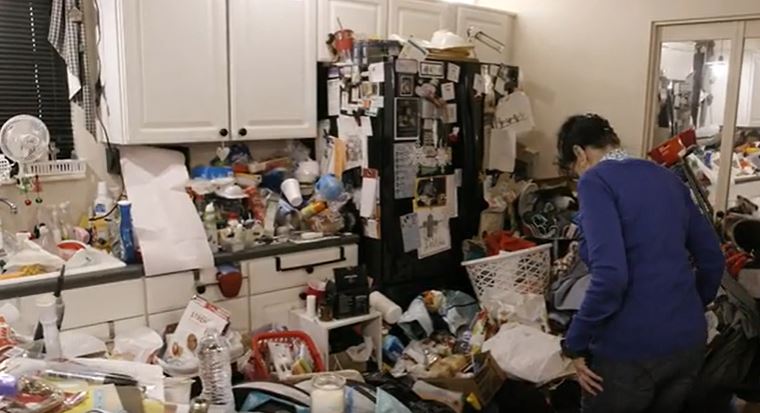
At what (x,y) coordinates should I click in order to perform the action: click on paper towel. Please return your answer as a coordinate pair (x, y). The height and width of the screenshot is (413, 760). Looking at the image, I should click on (166, 201).